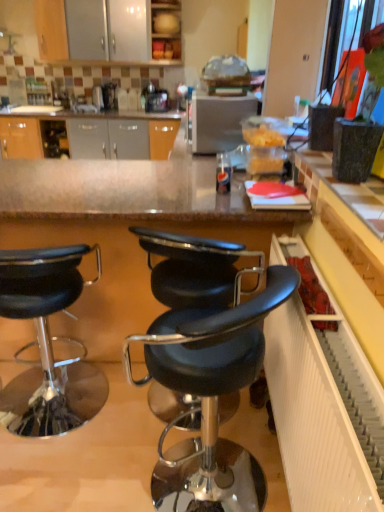
Question: From the image's perspective, is satin silver toaster at center located above black leather stool at center, which ranks as the 1th chair in right-to-left order?

Choices:
 (A) no
 (B) yes

Answer: (B)

Question: Is satin silver toaster at center positioned beyond the bounds of black leather stool at center, which ranks as the 1th chair in right-to-left order?

Choices:
 (A) yes
 (B) no

Answer: (A)

Question: Is satin silver toaster at center bigger than black leather stool at center, which ranks as the 1th chair in right-to-left order?

Choices:
 (A) yes
 (B) no

Answer: (B)

Question: Could you tell me if satin silver toaster at center is facing black leather stool at center, placed as the third chair when sorted from left to right?

Choices:
 (A) no
 (B) yes

Answer: (A)

Question: Does satin silver toaster at center have a lesser width compared to black leather stool at center, which ranks as the 1th chair in right-to-left order?

Choices:
 (A) yes
 (B) no

Answer: (A)

Question: From the image's perspective, is black leather stool at center, placed as the third chair when sorted from left to right, positioned above or below white glossy sink at upper center?

Choices:
 (A) below
 (B) above

Answer: (A)

Question: In the image, is black leather stool at center, which ranks as the 1th chair in right-to-left order, positioned in front of or behind white glossy sink at upper center?

Choices:
 (A) behind
 (B) front

Answer: (B)

Question: Looking at their shapes, would you say black leather stool at center, placed as the third chair when sorted from left to right, is wider or thinner than white glossy sink at upper center?

Choices:
 (A) thin
 (B) wide

Answer: (B)

Question: Does point (230, 358) appear closer or farther from the camera than point (76, 100)?

Choices:
 (A) closer
 (B) farther

Answer: (A)

Question: In the image, is white glossy sink at upper center positioned in front of or behind black leather stool at center, which is counted as the 2th chair, starting from the left?

Choices:
 (A) front
 (B) behind

Answer: (B)

Question: Considering the relative positions of white glossy sink at upper center and black leather stool at center, which ranks as the second chair in right-to-left order, in the image provided, is white glossy sink at upper center to the left or to the right of black leather stool at center, which ranks as the second chair in right-to-left order,?

Choices:
 (A) right
 (B) left

Answer: (B)

Question: From a real-world perspective, is white glossy sink at upper center positioned above or below black leather stool at center, which ranks as the second chair in right-to-left order?

Choices:
 (A) above
 (B) below

Answer: (A)

Question: Considering the positions of white glossy sink at upper center and black leather stool at center, which ranks as the second chair in right-to-left order, in the image, is white glossy sink at upper center bigger or smaller than black leather stool at center, which ranks as the second chair in right-to-left order,?

Choices:
 (A) small
 (B) big

Answer: (A)

Question: From a real-world perspective, is white glossy sink at upper center physically located above or below black leather stool at center, placed as the third chair when sorted from left to right?

Choices:
 (A) below
 (B) above

Answer: (B)

Question: Is white glossy sink at upper center bigger or smaller than black leather stool at center, placed as the third chair when sorted from left to right?

Choices:
 (A) big
 (B) small

Answer: (B)